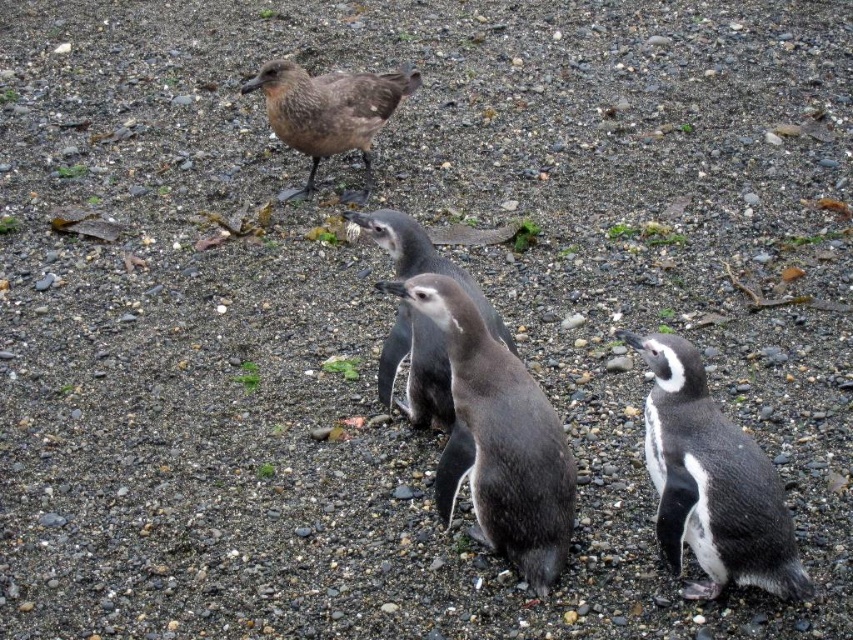
Question: Among these objects, which one is nearest to the camera?

Choices:
 (A) gray matte penguin at center
 (B) brown feathered bird at upper center
 (C) gray matte penguin at lower right

Answer: (C)

Question: Which object is positioned closest to the brown feathered bird at upper center?

Choices:
 (A) black glossy penguin at center
 (B) gray matte penguin at center
 (C) gray matte penguin at lower right

Answer: (A)

Question: Which point is farther to the camera?

Choices:
 (A) black glossy penguin at center
 (B) gray matte penguin at center
 (C) gray matte penguin at lower right

Answer: (A)

Question: Where is gray matte penguin at center located in relation to brown feathered bird at upper center in the image?

Choices:
 (A) left
 (B) right

Answer: (B)

Question: Can you confirm if gray matte penguin at lower right is positioned above black glossy penguin at center?

Choices:
 (A) no
 (B) yes

Answer: (A)

Question: Is gray matte penguin at lower right thinner than black glossy penguin at center?

Choices:
 (A) yes
 (B) no

Answer: (A)